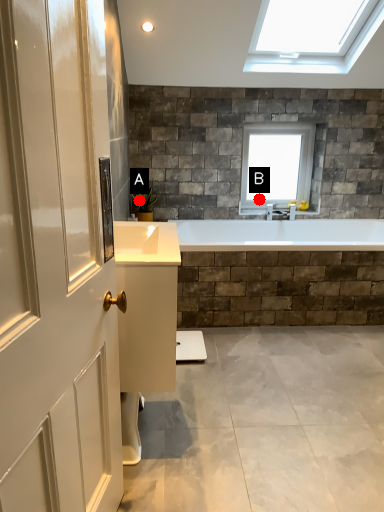
Question: Two points are circled on the image, labeled by A and B beside each circle. Which of the following is the farthest from the observer?

Choices:
 (A) A is further
 (B) B is further

Answer: (B)